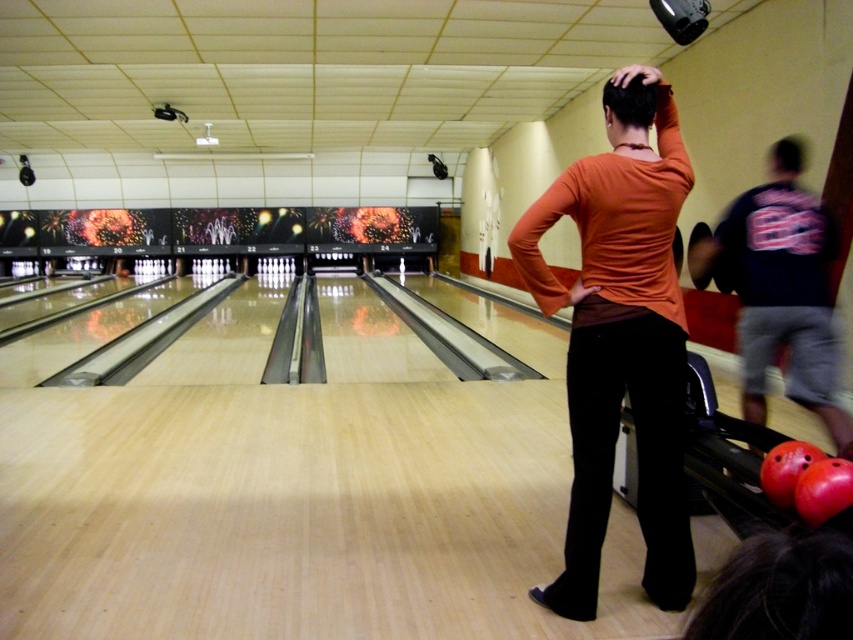
Question: Which of the following is the farthest from the observer?

Choices:
 (A) (636, 92)
 (B) (627, 164)
 (C) (770, 173)
 (D) (819, 282)

Answer: (C)

Question: Does dark blue t-shirt at center have a greater width compared to short brown hair at center?

Choices:
 (A) no
 (B) yes

Answer: (B)

Question: Can you confirm if orange matte shirt at center is positioned to the left of short brown hair at center?

Choices:
 (A) yes
 (B) no

Answer: (A)

Question: Is short brown hair at center bigger than blurred hair at upper right?

Choices:
 (A) no
 (B) yes

Answer: (A)

Question: Which object is the farthest from the short brown hair at center?

Choices:
 (A) blurred hair at upper right
 (B) orange matte shirt at center

Answer: (A)

Question: Which point is closer to the camera?

Choices:
 (A) (780, 310)
 (B) (614, 92)

Answer: (B)